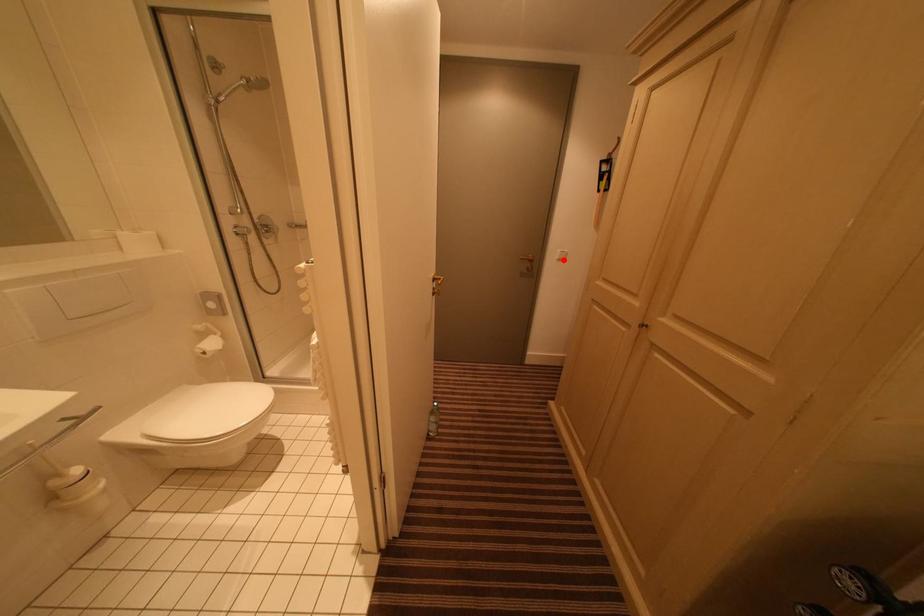
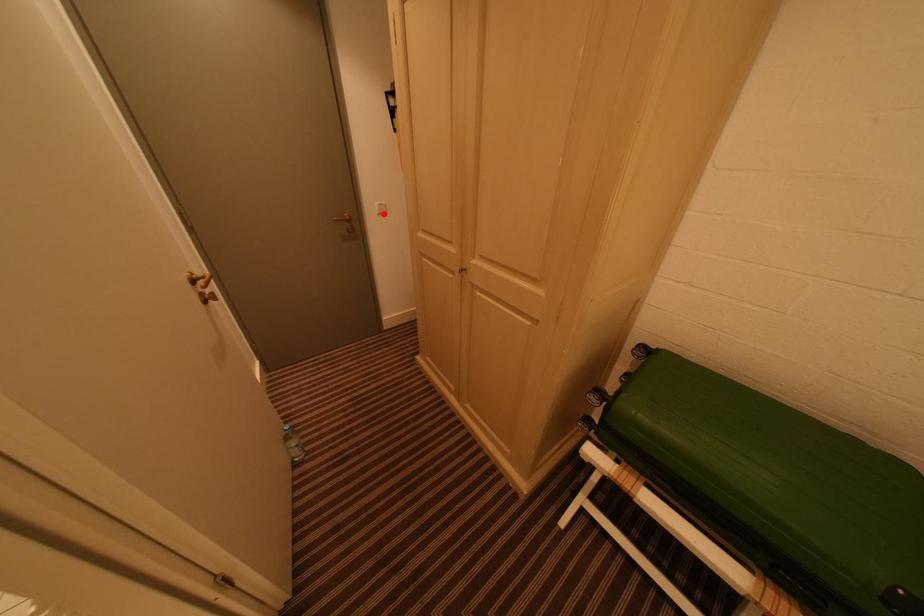
I am providing you with two images of the same scene from different viewpoints. A red point is marked on the first image and another point is marked on the second image. Is the marked point in image1 the same physical position as the marked point in image2?

Yes